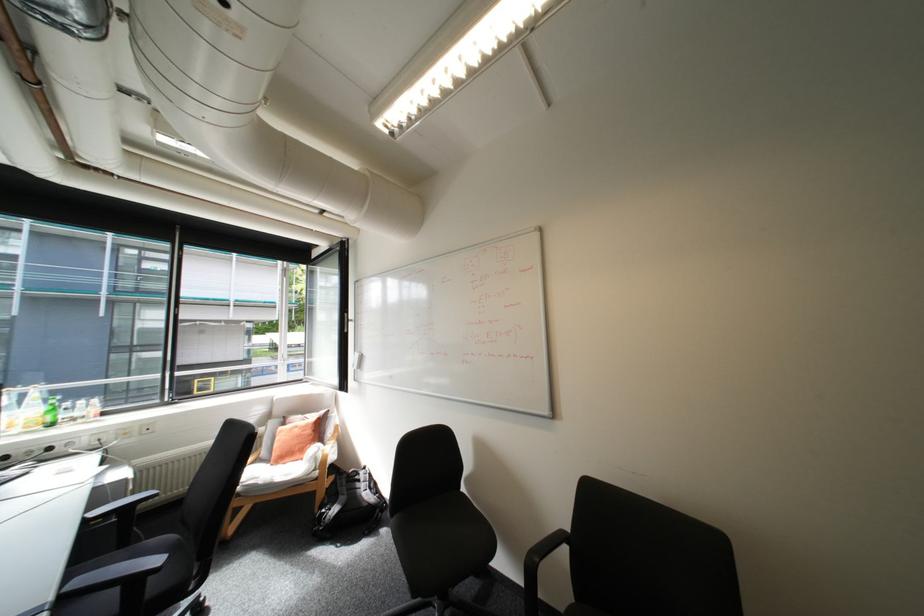
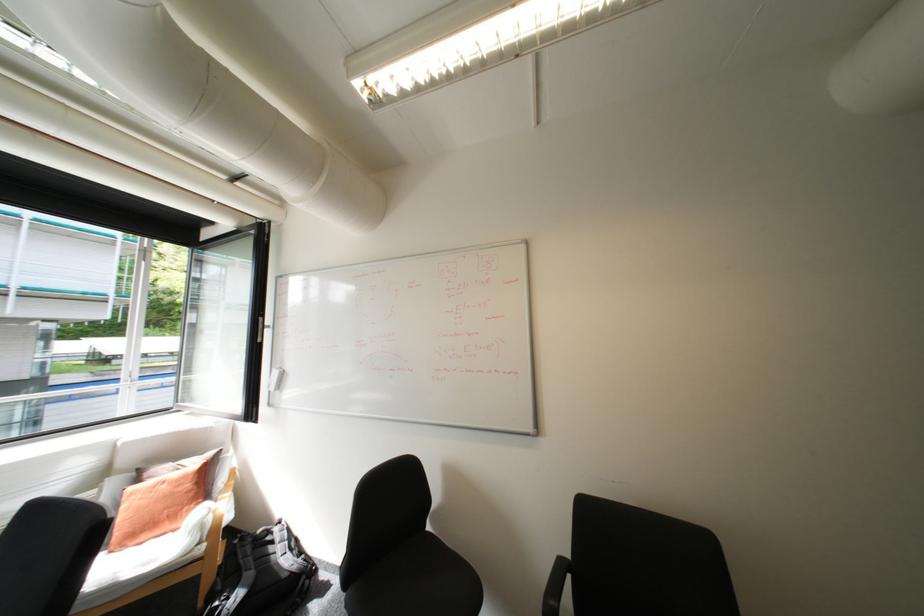
Question: The camera is either moving clockwise (left) or counter-clockwise (right) around the object. The first image is from the beginning of the video and the second image is from the end. Is the camera moving left or right when shooting the video?

Choices:
 (A) Left
 (B) Right

Answer: (A)